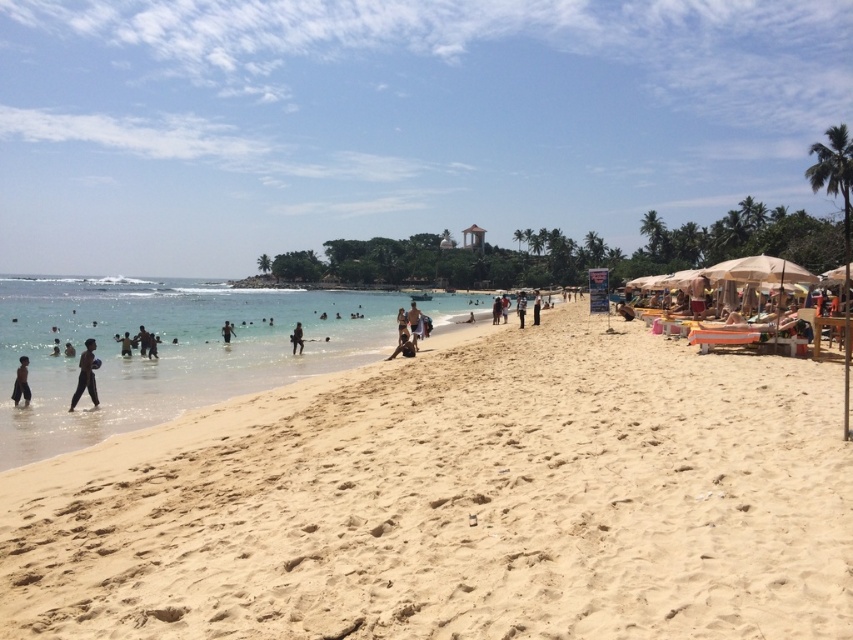
Does dark skin human at left come in front of dark blue fabric at center?

That is True.

At what (x,y) coordinates should I click in order to perform the action: click on dark skin human at left. Please return your answer as a coordinate pair (x, y). The height and width of the screenshot is (640, 853). Looking at the image, I should click on (21, 381).

In the scene shown: Is dark skin human at lower left taller than white cotton shirt at center?

In fact, dark skin human at lower left may be shorter than white cotton shirt at center.

Where is `dark skin human at lower left`? dark skin human at lower left is located at coordinates (86, 376).

I want to click on dark skin human at lower left, so click(x=86, y=376).

Find the location of a particular element. This screenshot has width=853, height=640. dark skin human at lower left is located at coordinates (86, 376).